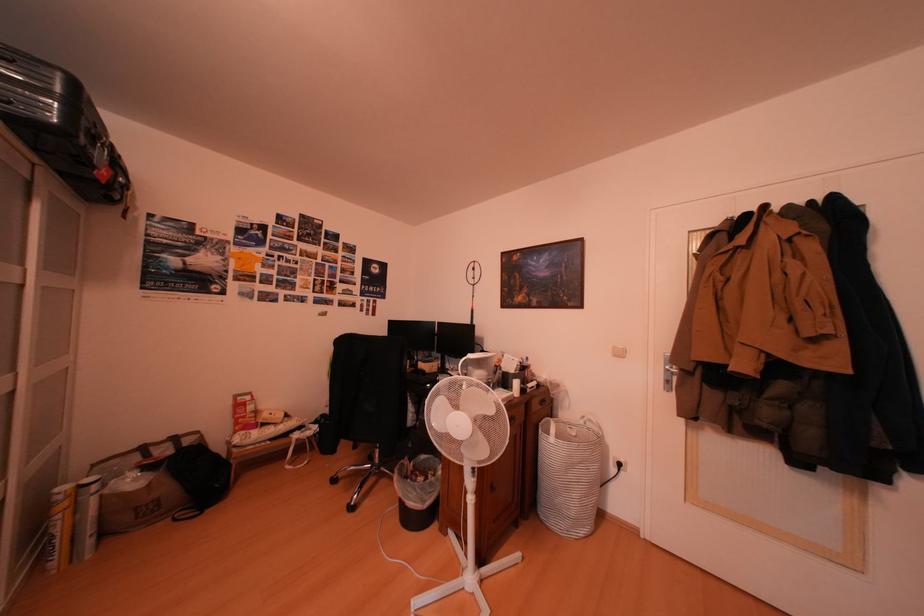
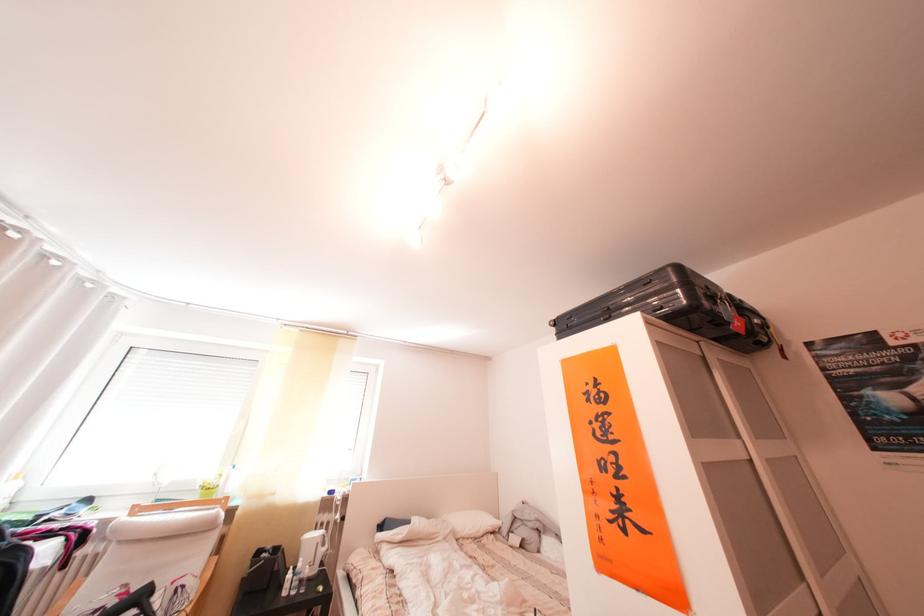
In the second image, find the point that corresponds to [35,270] in the first image.

(751, 442)